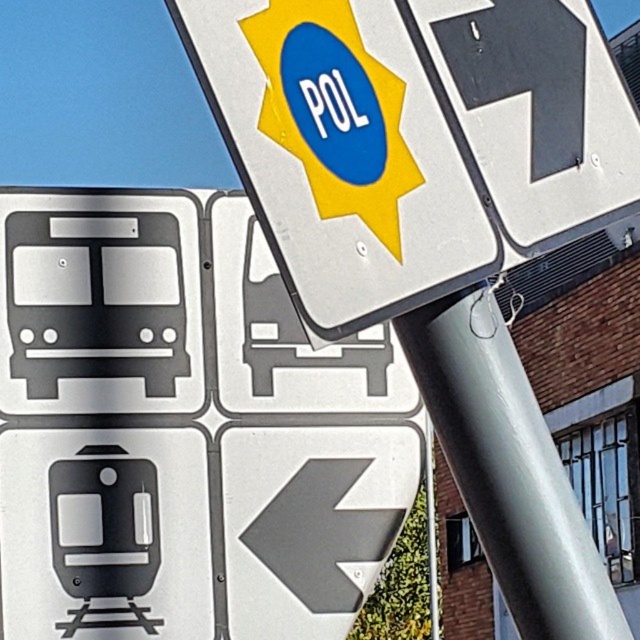
Between metallic silver sign at upper center and black matte arrow at upper right, which one is positioned lower?

metallic silver sign at upper center is lower down.

Is point (291, 88) farther from camera compared to point (579, 97)?

No, (291, 88) is in front of (579, 97).

Identify the location of metallic silver sign at upper center. This screenshot has width=640, height=640. 340,154.

Can you confirm if metallic silver sign at upper center is thinner than metallic gray arrow at lower left?

No.

Who is taller, metallic silver sign at upper center or metallic gray arrow at lower left?

With more height is metallic silver sign at upper center.

Describe the element at coordinates (340, 154) in the screenshot. I see `metallic silver sign at upper center` at that location.

Find the location of a particular element. The height and width of the screenshot is (640, 640). metallic silver sign at upper center is located at coordinates (340, 154).

Between silver metallic pole at center and black matte arrow at upper right, which one has more height?

With more height is silver metallic pole at center.

Can you confirm if silver metallic pole at center is positioned above black matte arrow at upper right?

No.

Does point (529, 564) come behind point (528, 35)?

That is False.

Identify the location of silver metallic pole at center. (508, 468).